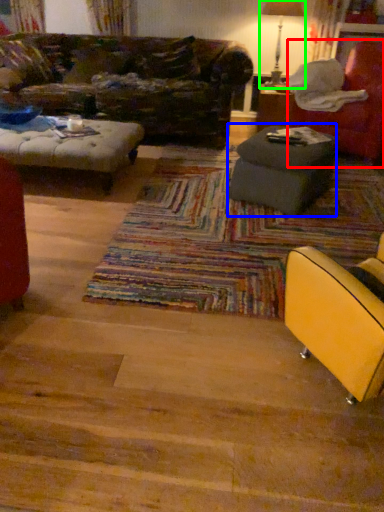
Question: Based on their relative distances, which object is nearer to chair (highlighted by a red box)? Choose from table (highlighted by a blue box) and table lamp (highlighted by a green box).

Choices:
 (A) table
 (B) table lamp

Answer: (A)